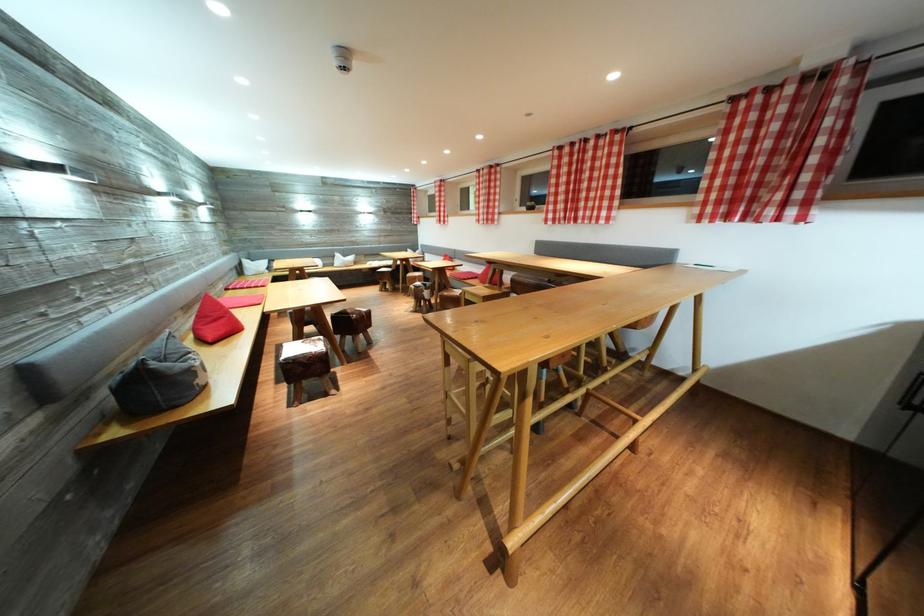
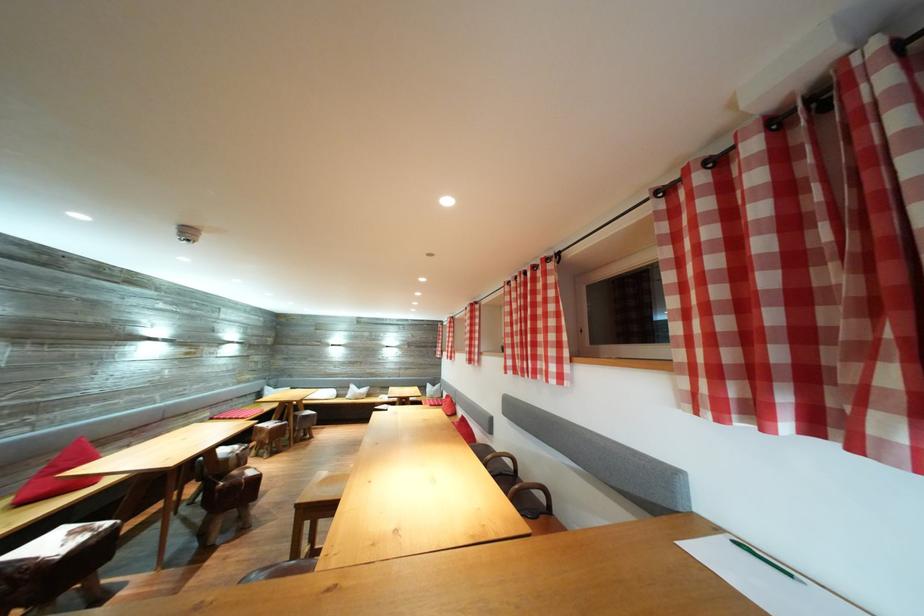
Question: I am providing you with two images of the same scene from different viewpoints. Which of the following objects are not visible in image2?

Choices:
 (A) wooden stool
 (B) chair sitting surface
 (C) dark chair armrest
 (D) small jar lid

Answer: (A)